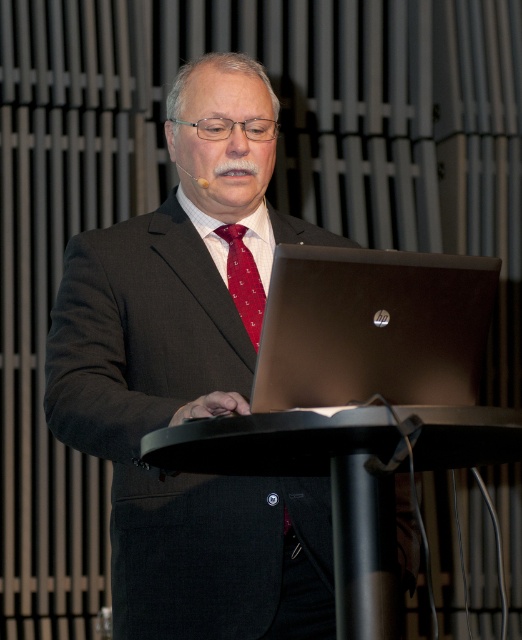
In the scene shown: Does satin black laptop at center have a smaller size compared to black plastic podium at center?

Yes.

Is point (488, 328) positioned behind point (378, 442)?

Yes, it is.

Locate an element on the screen. This screenshot has width=522, height=640. satin black laptop at center is located at coordinates (373, 326).

Which is in front, point (172, 282) or point (453, 282)?

Point (453, 282)

Which is below, matte black suit at center or satin black laptop at center?

Positioned lower is satin black laptop at center.

Describe the element at coordinates (191, 381) in the screenshot. I see `matte black suit at center` at that location.

The width and height of the screenshot is (522, 640). In order to click on matte black suit at center in this screenshot , I will do `click(191, 381)`.

Does matte black suit at center appear on the left side of silky red tie at center?

Yes, matte black suit at center is to the left of silky red tie at center.

Does point (118, 625) lie in front of point (251, 308)?

Yes, point (118, 625) is in front of point (251, 308).

Image resolution: width=522 pixels, height=640 pixels. Identify the location of matte black suit at center. (191, 381).

Where is `matte black suit at center`? matte black suit at center is located at coordinates (191, 381).